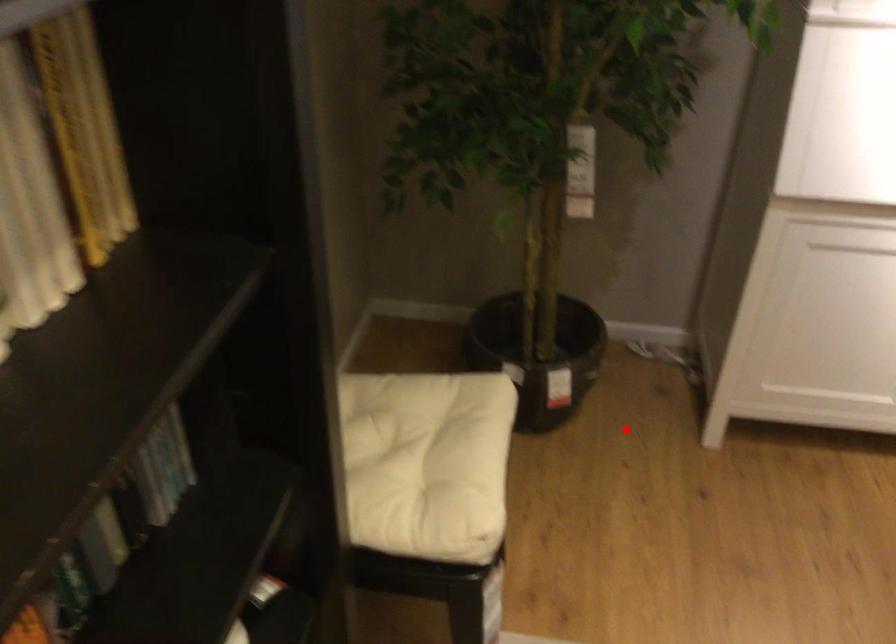
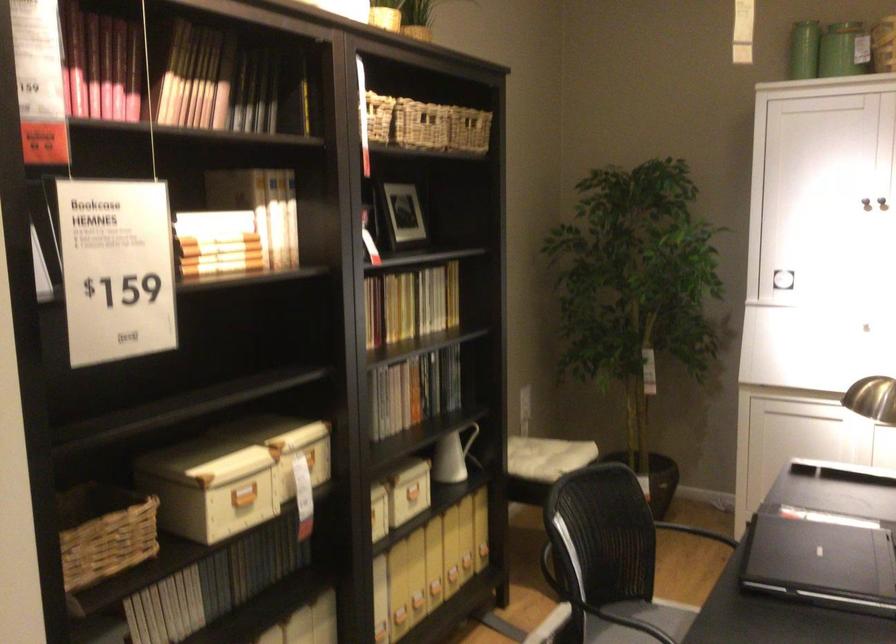
Question: I am providing you with two images of the same scene from different viewpoints. In image1, a red point is highlighted. Considering the same 3D point in image2, which of the following is correct?

Choices:
 (A) It is closer
 (B) It is farther

Answer: (B)